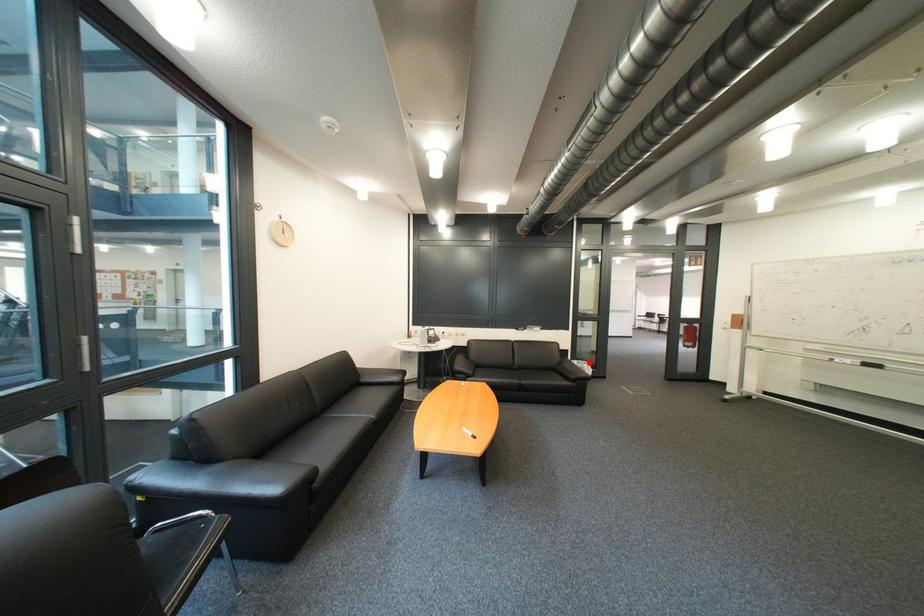
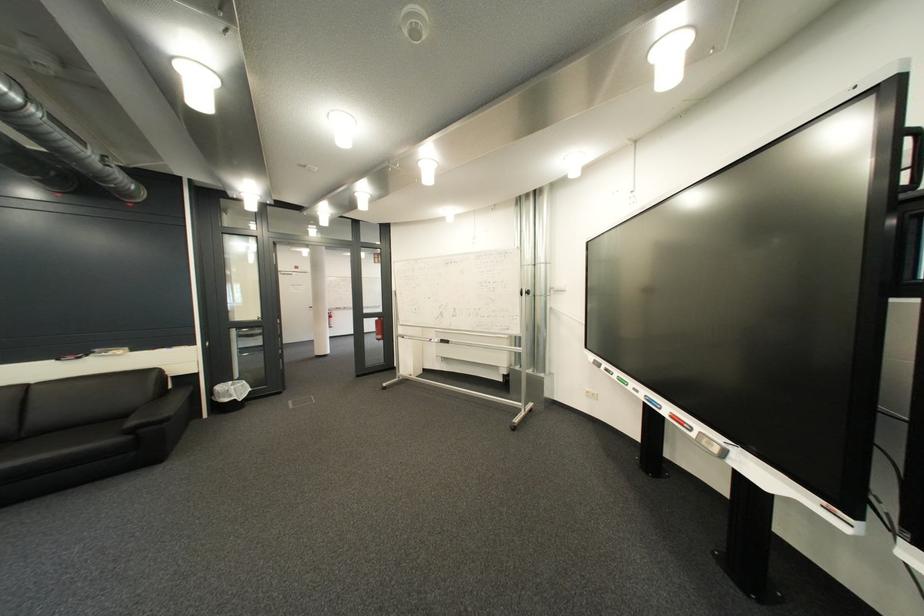
Locate, in the second image, the point that corresponds to the highlighted location in the first image.

(245, 384)